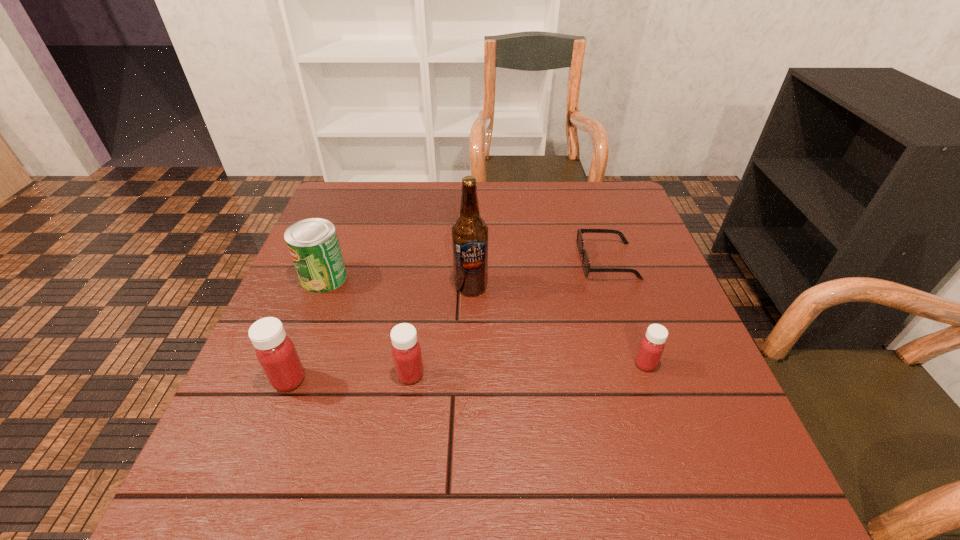
This screenshot has width=960, height=540. In order to click on the leftmost medicine in this screenshot , I will do `click(275, 351)`.

Where is `the second tallest medicine`? The image size is (960, 540). the second tallest medicine is located at coordinates (406, 351).

Identify the location of the fourth object from right to left. pyautogui.click(x=406, y=351).

Find the location of a particular element. Image resolution: width=960 pixels, height=540 pixels. the shortest medicine is located at coordinates (652, 345).

The width and height of the screenshot is (960, 540). I want to click on the second shortest object, so click(652, 345).

Where is `can`? The width and height of the screenshot is (960, 540). can is located at coordinates (313, 244).

The image size is (960, 540). Identify the location of the tallest object. (469, 233).

Image resolution: width=960 pixels, height=540 pixels. I want to click on beer bottle, so click(x=469, y=233).

Image resolution: width=960 pixels, height=540 pixels. Find the location of `sunglasses`. sunglasses is located at coordinates (580, 242).

This screenshot has width=960, height=540. Find the location of `vacant area situated 0.200m on the back of the tallest medicine`. vacant area situated 0.200m on the back of the tallest medicine is located at coordinates (321, 296).